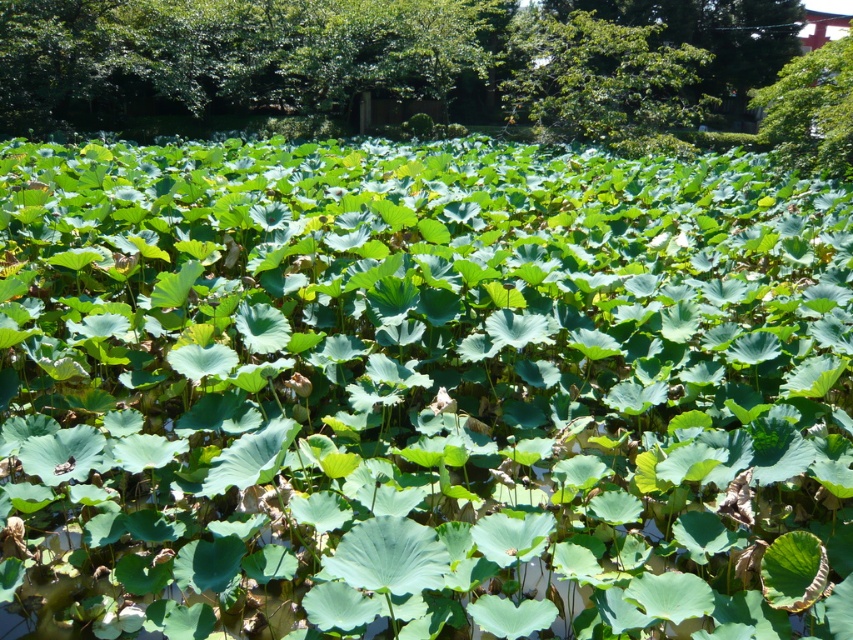
You are standing at the edge of the pond surrounded by lotus leaves and want to reach the green leafy tree at upper center. If your walking speed is 3 feet per second, how many seconds will it take you to reach the tree?

The green leafy tree at upper center is 53.48 feet away from the viewer. At a walking speed of 3 feet per second, it would take approximately 17.83 seconds to reach the tree.

You are a bird looking for a nesting spot. You see two trees in the image, the green leafy tree at upper center and the green leafy tree at upper right. Which tree is taller and would provide a better vantage point?

The green leafy tree at upper center is much taller than the green leafy tree at upper right, so it would provide a better vantage point.